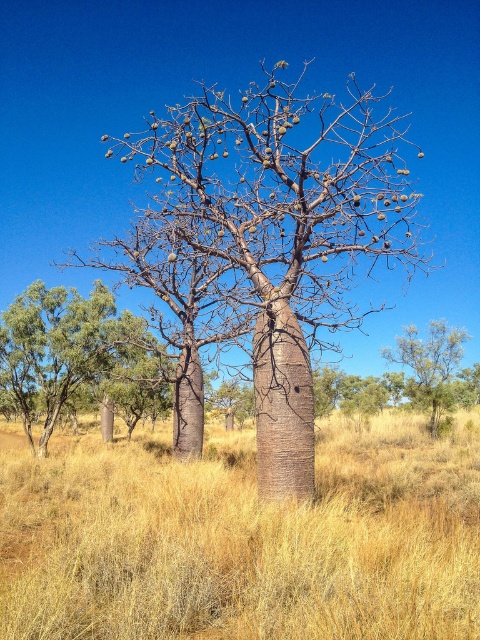
Question: Which of these objects is positioned closest to the green leafy shrub at upper center?

Choices:
 (A) smooth brown tree trunk at center
 (B) green rough bark tree at lower left

Answer: (A)

Question: Which object is farther from the camera taking this photo?

Choices:
 (A) green rough bark tree at lower left
 (B) dry grass at center
 (C) smooth brown tree trunk at center

Answer: (A)

Question: Among these points, which one is farthest from the camera?

Choices:
 (A) (403, 340)
 (B) (290, 625)
 (C) (310, 132)

Answer: (A)

Question: Is smooth brown tree trunk at center smaller than green rough bark tree at lower left?

Choices:
 (A) yes
 (B) no

Answer: (B)

Question: Does dry grass at center appear over green leafy shrub at upper center?

Choices:
 (A) no
 (B) yes

Answer: (A)

Question: Does dry grass at center have a greater width compared to smooth brown tree trunk at center?

Choices:
 (A) yes
 (B) no

Answer: (B)